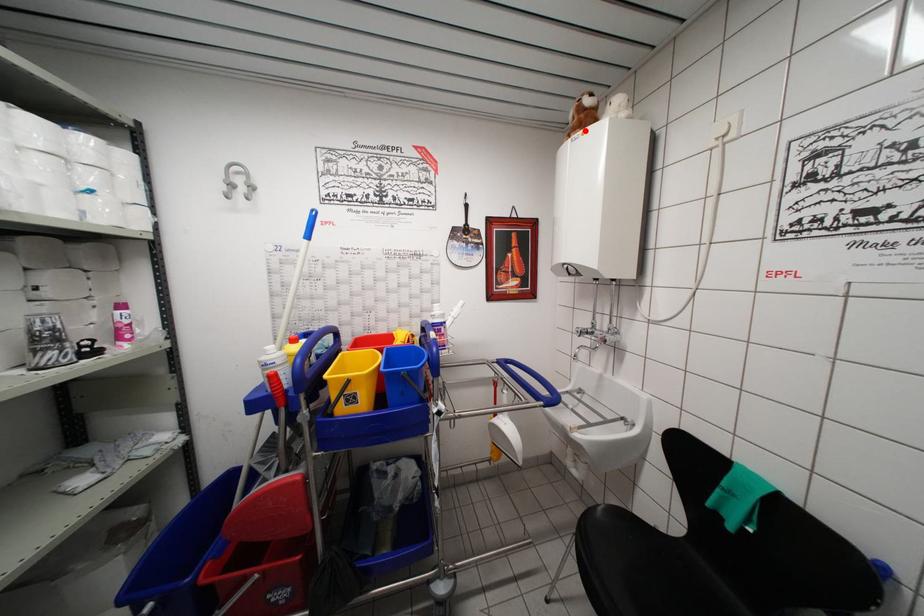
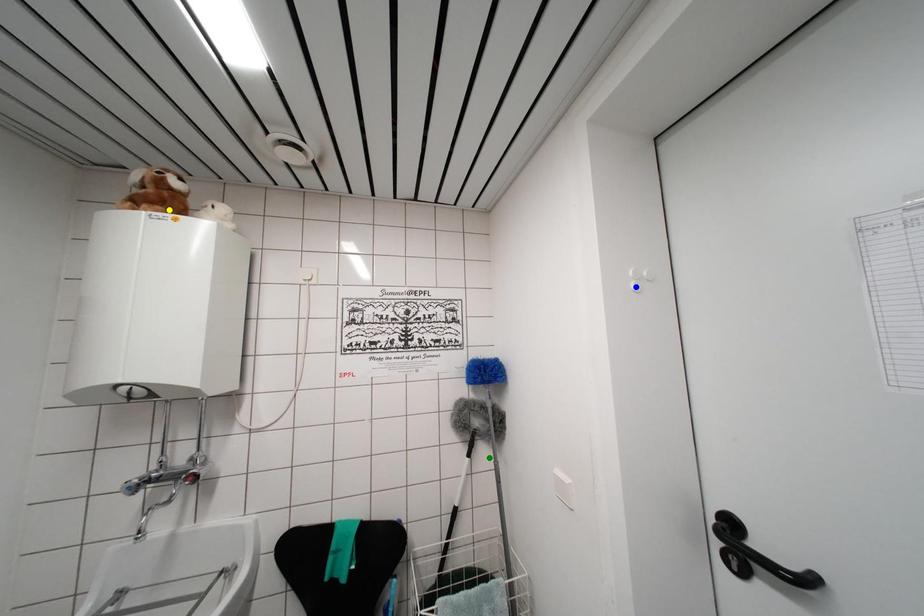
Question: I am providing you with two images of the same scene from different viewpoints. A red point is marked on the first image. You are given multiple points on the second image. Which mark in image 2 goes with the point in image 1?

Choices:
 (A) yellow point
 (B) blue point
 (C) green point

Answer: (A)